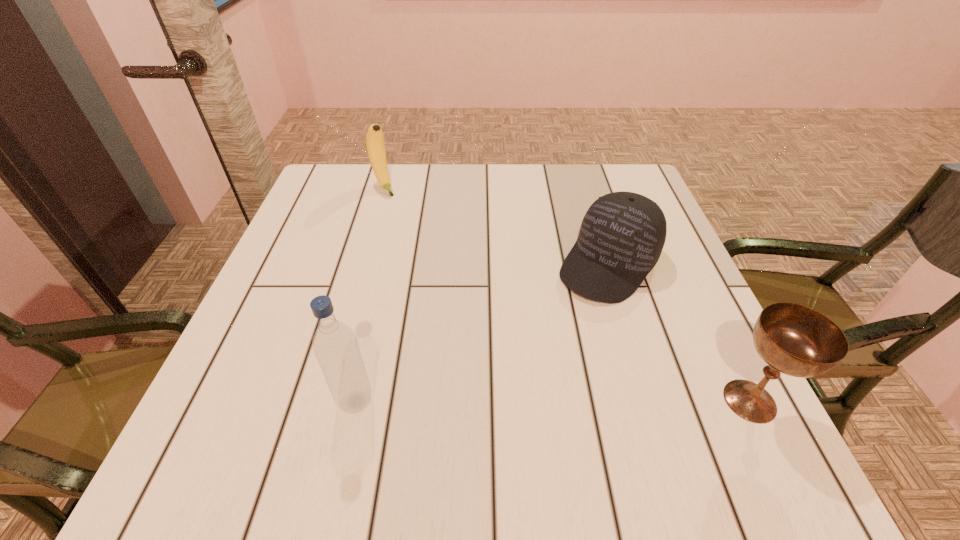
What are the coordinates of `vacant position located 0.070m from the stem of the banana` in the screenshot? It's located at (396, 209).

This screenshot has width=960, height=540. In order to click on blank space located 0.160m from the stem of the banana in this screenshot , I will do `click(410, 228)`.

This screenshot has width=960, height=540. Identify the location of vacant space located from the stem of the banana. (432, 260).

Identify the location of object located in the far edge section of the desktop. (375, 145).

I want to click on water bottle that is positioned at the near edge, so click(x=335, y=345).

You are a GUI agent. You are given a task and a screenshot of the screen. Output one action in this format:
    pyautogui.click(x=<x>, y=<y>)
    Task: Click on the chalice that is at the near edge
    
    Given the screenshot: What is the action you would take?
    pyautogui.click(x=793, y=339)

Locate an element on the screen. This screenshot has height=540, width=960. object located in the left edge section of the desktop is located at coordinates (375, 145).

The image size is (960, 540). In order to click on chalice positioned at the right edge in this screenshot , I will do `click(793, 339)`.

This screenshot has height=540, width=960. What are the coordinates of `baseball cap that is at the right edge` in the screenshot? It's located at (622, 235).

At what (x,y) coordinates should I click in order to perform the action: click on object positioned at the far left corner. Please return your answer as a coordinate pair (x, y). This screenshot has width=960, height=540. Looking at the image, I should click on (375, 145).